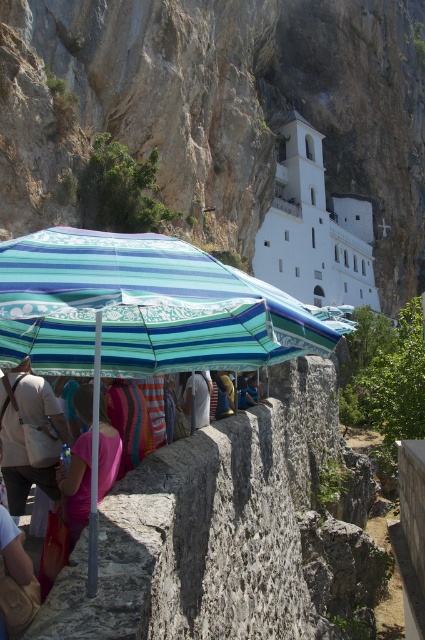
Can you confirm if light pink fabric bag at lower left is shorter than pink fabric at center?

No.

Is light pink fabric bag at lower left to the right of pink fabric at center from the viewer's perspective?

No, light pink fabric bag at lower left is not to the right of pink fabric at center.

Which is in front, point (39, 465) or point (82, 486)?

Point (82, 486) is more forward.

The image size is (425, 640). I want to click on light pink fabric bag at lower left, so click(28, 435).

Is point (277, 204) in front of point (33, 458)?

No, it is behind (33, 458).

Which of these two, white stone building at center or light pink fabric bag at lower left, stands taller?

white stone building at center is taller.

At what (x,y) coordinates should I click in order to perform the action: click on white stone building at center. Please return your answer as a coordinate pair (x, y). Looking at the image, I should click on (314, 228).

Does point (51, 296) come farther from viewer compared to point (79, 408)?

That is False.

Who is lower down, striped fabric umbrella at center or pink fabric at center?

Positioned lower is pink fabric at center.

The width and height of the screenshot is (425, 640). What do you see at coordinates (141, 307) in the screenshot?
I see `striped fabric umbrella at center` at bounding box center [141, 307].

Where is `striped fabric umbrella at center`? Image resolution: width=425 pixels, height=640 pixels. striped fabric umbrella at center is located at coordinates (141, 307).